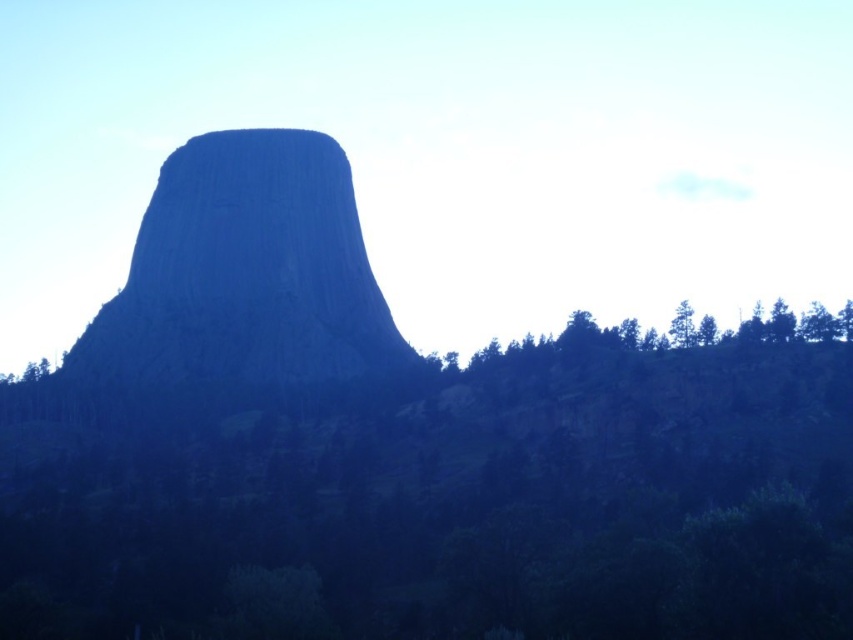
You are a hiker standing at the base of Devils Tower. You see the green leafy trees at lower right and the green leafy tree at upper right. Which tree is closer to you?

The green leafy trees at lower right are closer to you since they are positioned at the lower part of the scene compared to the green leafy tree at upper right, which is further away.

You are a hiker standing at the base of the rugged stone mountain at center. You want to reach the summit. Do you think the green leafy trees at lower right are in your path to the top?

The rugged stone mountain at center is above the green leafy trees at lower right, so the trees are below the mountain. Since you are at the base of the mountain, the trees are not in your path to the summit.

You are a hiker standing at the base of the rugged stone mountain at center and want to take a photo of the green leafy tree at upper right. Which direction should you face to capture the tree in your viewfinder?

You should face to the right because the rugged stone mountain at center is positioned to the left of the green leafy tree at upper right, so turning right will align the tree within your view.